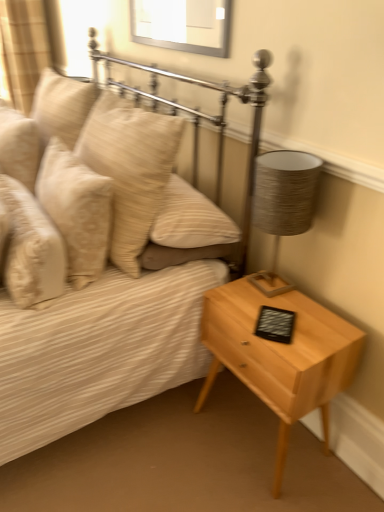
Question: Does textured gray lampshade at right appear on the right side of light wood/texture nightstand at lower right?

Choices:
 (A) no
 (B) yes

Answer: (B)

Question: From a real-world perspective, is textured gray lampshade at right beneath light wood/texture nightstand at lower right?

Choices:
 (A) yes
 (B) no

Answer: (B)

Question: Is light wood/texture nightstand at lower right inside textured gray lampshade at right?

Choices:
 (A) yes
 (B) no

Answer: (B)

Question: Is textured gray lampshade at right at the left side of light wood/texture nightstand at lower right?

Choices:
 (A) yes
 (B) no

Answer: (B)

Question: From a real-world perspective, is textured gray lampshade at right on light wood/texture nightstand at lower right?

Choices:
 (A) no
 (B) yes

Answer: (B)

Question: Is textured gray lampshade at right positioned behind light wood/texture nightstand at lower right?

Choices:
 (A) no
 (B) yes

Answer: (B)

Question: Is light wood/texture nightstand at lower right shorter than matte beige bed at center?

Choices:
 (A) yes
 (B) no

Answer: (A)

Question: From a real-world perspective, is light wood/texture nightstand at lower right physically below matte beige bed at center?

Choices:
 (A) yes
 (B) no

Answer: (A)

Question: Is light wood/texture nightstand at lower right not within matte beige bed at center?

Choices:
 (A) yes
 (B) no

Answer: (A)

Question: Considering the relative positions of light wood/texture nightstand at lower right and matte beige bed at center in the image provided, is light wood/texture nightstand at lower right to the left of matte beige bed at center from the viewer's perspective?

Choices:
 (A) yes
 (B) no

Answer: (B)

Question: Could you tell me if light wood/texture nightstand at lower right is turned towards matte beige bed at center?

Choices:
 (A) no
 (B) yes

Answer: (A)

Question: Is light wood/texture nightstand at lower right turned away from matte beige bed at center?

Choices:
 (A) no
 (B) yes

Answer: (A)

Question: Considering the relative sizes of beige textured pillow at left, acting as the 1th pillow starting from the left, and beige textured pillow at left, which is the 3th pillow in right-to-left order, in the image provided, is beige textured pillow at left, acting as the 1th pillow starting from the left, bigger than beige textured pillow at left, which is the 3th pillow in right-to-left order,?

Choices:
 (A) yes
 (B) no

Answer: (B)